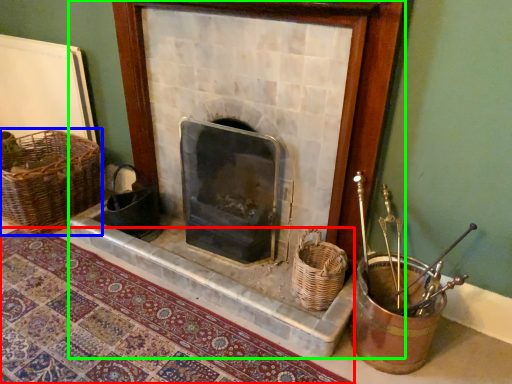
Question: Estimate the real-world distances between objects in this image. Which object is closer to mat (highlighted by a red box), basket (highlighted by a blue box) or fireplace (highlighted by a green box)?

Choices:
 (A) basket
 (B) fireplace

Answer: (B)